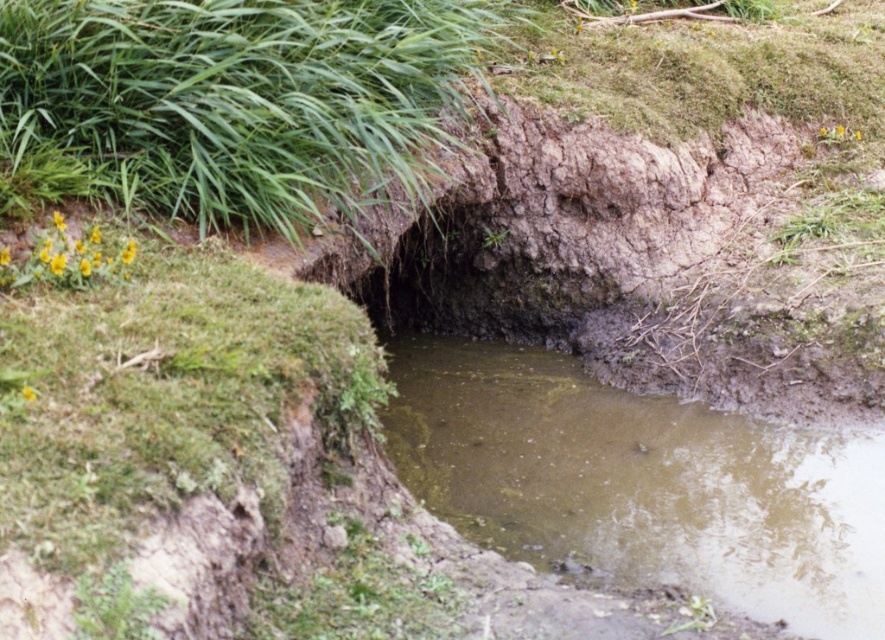
Question: Which object is farther from the camera taking this photo?

Choices:
 (A) green grass at upper left
 (B) brown muddy stream at center

Answer: (A)

Question: Is the position of brown muddy stream at center less distant than that of green grass at upper left?

Choices:
 (A) yes
 (B) no

Answer: (A)

Question: Does brown muddy stream at center have a lesser width compared to green grass at upper left?

Choices:
 (A) yes
 (B) no

Answer: (B)

Question: Observing the image, what is the correct spatial positioning of brown muddy stream at center in reference to green grass at upper left?

Choices:
 (A) left
 (B) right

Answer: (B)

Question: Among these objects, which one is farthest from the camera?

Choices:
 (A) brown muddy stream at center
 (B) green grass at upper left

Answer: (B)

Question: Which point appears farthest from the camera in this image?

Choices:
 (A) (140, 68)
 (B) (526, 528)

Answer: (B)